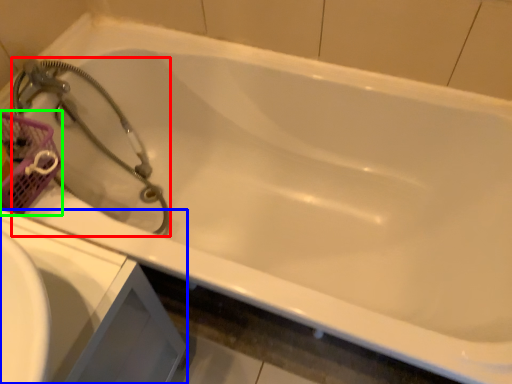
Question: Which is farther away from garden hose (highlighted by a red box)? sink (highlighted by a blue box) or basket (highlighted by a green box)?

Choices:
 (A) sink
 (B) basket

Answer: (A)